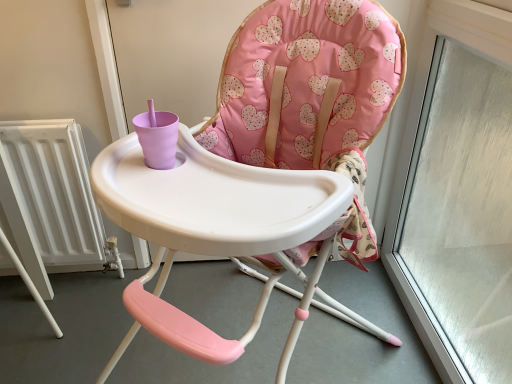
Locate an element on the screen. This screenshot has width=512, height=384. pink fabric highchair at center is located at coordinates (286, 140).

Based on the photo, in order to face pink fabric highchair at center, should I rotate leftwards or rightwards?

You should look left and rotate roughly 0.767 degrees.

Image resolution: width=512 pixels, height=384 pixels. Describe the element at coordinates (286, 140) in the screenshot. I see `pink fabric highchair at center` at that location.

Where is `white metallic radiator at left`? The height and width of the screenshot is (384, 512). white metallic radiator at left is located at coordinates (52, 200).

Describe the element at coordinates (52, 200) in the screenshot. I see `white metallic radiator at left` at that location.

Find the location of a particular element. pink fabric highchair at center is located at coordinates (286, 140).

Is white metallic radiator at left to the left of pink fabric highchair at center from the viewer's perspective?

Yes, white metallic radiator at left is to the left of pink fabric highchair at center.

Which object is more forward, white metallic radiator at left or pink fabric highchair at center?

Positioned in front is pink fabric highchair at center.

Is point (17, 146) closer or farther from the camera than point (224, 342)?

Point (17, 146) appears to be farther away from the viewer than point (224, 342).

From the image's perspective, does white metallic radiator at left appear lower than pink fabric highchair at center?

No.

From a real-world perspective, which object rests below the other?

From a 3D spatial view, white metallic radiator at left is below.

From the picture: Can you confirm if white metallic radiator at left is wider than pink fabric highchair at center?

No, white metallic radiator at left is not wider than pink fabric highchair at center.

Who is shorter, white metallic radiator at left or pink fabric highchair at center?

Standing shorter between the two is white metallic radiator at left.

Considering the sizes of objects white metallic radiator at left and pink fabric highchair at center in the image provided, who is smaller, white metallic radiator at left or pink fabric highchair at center?

white metallic radiator at left.

Is white metallic radiator at left not inside pink fabric highchair at center?

That's correct, white metallic radiator at left is outside of pink fabric highchair at center.

Are white metallic radiator at left and pink fabric highchair at center far apart?

Actually, white metallic radiator at left and pink fabric highchair at center are a little close together.

Is white metallic radiator at left positioned with its back to pink fabric highchair at center?

That's not correct — white metallic radiator at left is not looking away from pink fabric highchair at center.

How many degrees apart are the facing directions of white metallic radiator at left and pink fabric highchair at center?

The angular difference between white metallic radiator at left and pink fabric highchair at center is 42.4 degrees.

The image size is (512, 384). I want to click on radiator above the pink fabric highchair at center (from the image's perspective), so click(52, 200).

Looking at this image, can you confirm if pink fabric highchair at center is positioned to the left of white metallic radiator at left?

In fact, pink fabric highchair at center is to the right of white metallic radiator at left.

Is the position of pink fabric highchair at center less distant than that of white metallic radiator at left?

Yes, pink fabric highchair at center is closer to the camera.

Which is behind, point (292, 92) or point (49, 168)?

Positioned behind is point (49, 168).

From the image's perspective, is pink fabric highchair at center above or below white metallic radiator at left?

pink fabric highchair at center is situated lower than white metallic radiator at left in the image.

From a real-world perspective, does pink fabric highchair at center sit lower than white metallic radiator at left?

Actually, pink fabric highchair at center is physically above white metallic radiator at left in the real world.

Is pink fabric highchair at center thinner than white metallic radiator at left?

No, pink fabric highchair at center is not thinner than white metallic radiator at left.

Can you confirm if pink fabric highchair at center is shorter than white metallic radiator at left?

No, pink fabric highchair at center is not shorter than white metallic radiator at left.

Between pink fabric highchair at center and white metallic radiator at left, which one has larger size?

With larger size is pink fabric highchair at center.

Consider the image. Is pink fabric highchair at center located outside white metallic radiator at left?

Indeed, pink fabric highchair at center is completely outside white metallic radiator at left.

From the picture: Would you say pink fabric highchair at center is a long distance from white metallic radiator at left?

No, pink fabric highchair at center is in close proximity to white metallic radiator at left.

In the scene shown: Is pink fabric highchair at center positioned with its back to white metallic radiator at left?

No, pink fabric highchair at center's orientation is not away from white metallic radiator at left.

What's the angular difference between pink fabric highchair at center and white metallic radiator at left's facing directions?

They differ by 42.4 degrees in their facing directions.

Measure the distance from pink fabric highchair at center to white metallic radiator at left.

They are 59.86 centimeters apart.

Find the location of a particular element. The height and width of the screenshot is (384, 512). chair located above the white metallic radiator at left (from a real-world perspective) is located at coordinates (286, 140).

At what (x,y) coordinates should I click in order to perform the action: click on radiator above the pink fabric highchair at center (from the image's perspective). Please return your answer as a coordinate pair (x, y). The height and width of the screenshot is (384, 512). Looking at the image, I should click on (52, 200).

At what (x,y) coordinates should I click in order to perform the action: click on radiator behind the pink fabric highchair at center. Please return your answer as a coordinate pair (x, y). Looking at the image, I should click on (52, 200).